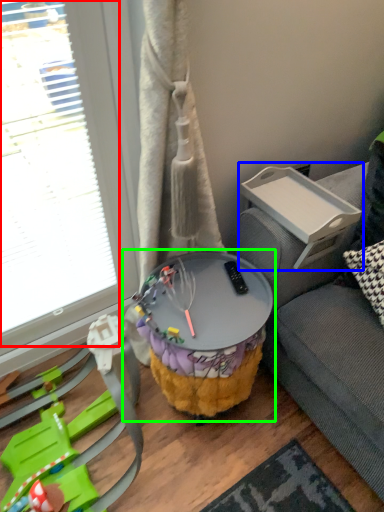
Question: Based on their relative distances, which object is farther from glass door (highlighted by a red box)? Choose from table (highlighted by a blue box) and table (highlighted by a green box).

Choices:
 (A) table
 (B) table

Answer: (A)